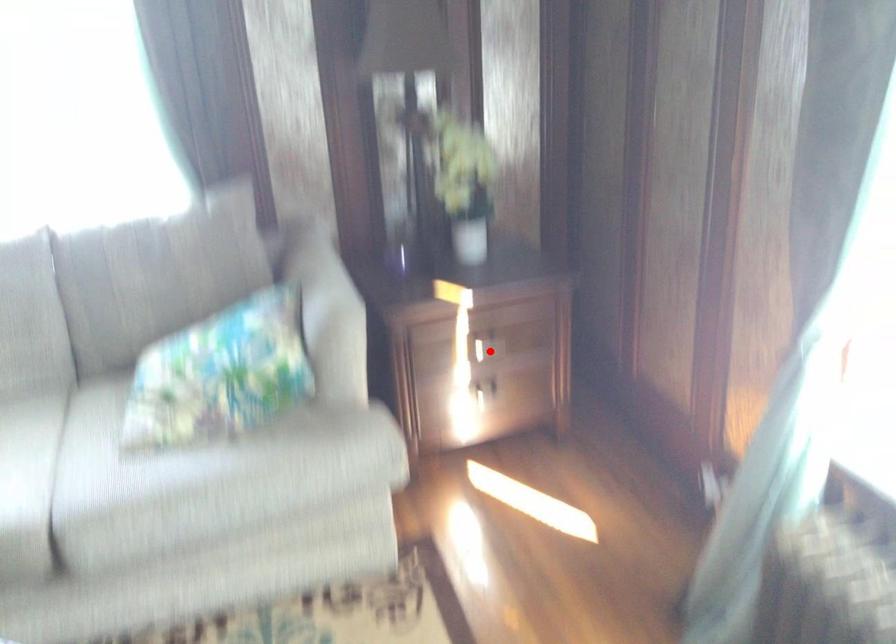
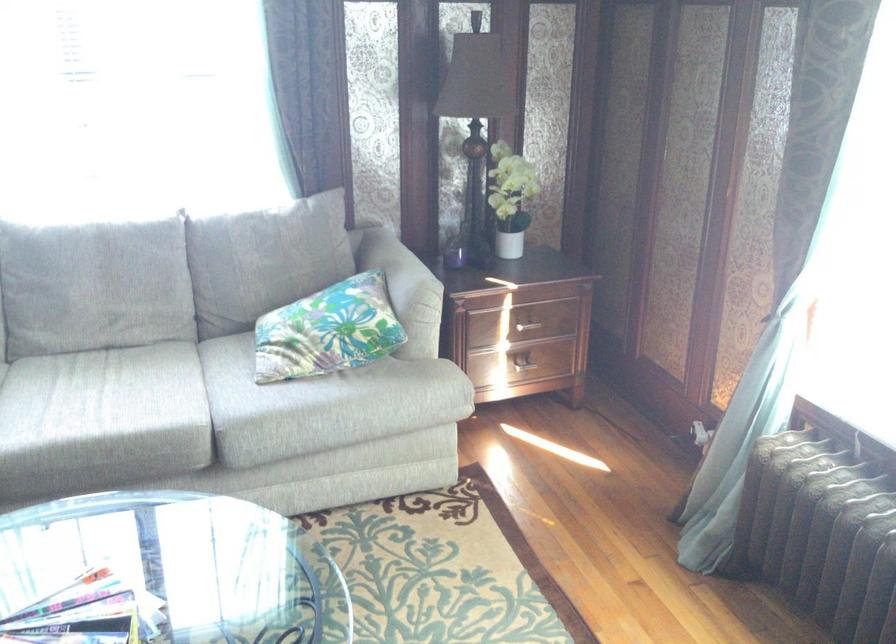
Question: I am providing you with two images of the same scene from different viewpoints. In image1, a red point is highlighted. Considering the same 3D point in image2, which of the following is correct?

Choices:
 (A) It is closer
 (B) It is farther

Answer: (B)